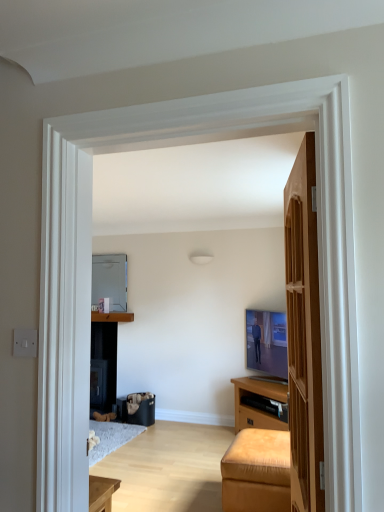
Question: Does leather ottoman at lower right have a greater width compared to wooden door at right?

Choices:
 (A) yes
 (B) no

Answer: (A)

Question: From the image's perspective, would you say leather ottoman at lower right is shown under wooden door at right?

Choices:
 (A) yes
 (B) no

Answer: (A)

Question: Considering the relative sizes of leather ottoman at lower right and wooden door at right in the image provided, is leather ottoman at lower right taller than wooden door at right?

Choices:
 (A) yes
 (B) no

Answer: (B)

Question: Is leather ottoman at lower right at the left side of wooden door at right?

Choices:
 (A) no
 (B) yes

Answer: (A)

Question: Is leather ottoman at lower right positioned beyond the bounds of wooden door at right?

Choices:
 (A) yes
 (B) no

Answer: (A)

Question: From a real-world perspective, is metallic refrigerator at center positioned above or below leather ottoman at lower right?

Choices:
 (A) above
 (B) below

Answer: (A)

Question: Is metallic refrigerator at center situated inside leather ottoman at lower right or outside?

Choices:
 (A) inside
 (B) outside

Answer: (B)

Question: Based on their positions, is metallic refrigerator at center located to the left or right of leather ottoman at lower right?

Choices:
 (A) left
 (B) right

Answer: (A)

Question: Considering the positions of point (92, 291) and point (244, 478), is point (92, 291) closer or farther from the camera than point (244, 478)?

Choices:
 (A) closer
 (B) farther

Answer: (B)

Question: Is matte brown cabinet at center wider or thinner than metallic refrigerator at center?

Choices:
 (A) thin
 (B) wide

Answer: (B)

Question: Based on their positions, is matte brown cabinet at center located to the left or right of metallic refrigerator at center?

Choices:
 (A) right
 (B) left

Answer: (A)

Question: Is matte brown cabinet at center bigger or smaller than metallic refrigerator at center?

Choices:
 (A) big
 (B) small

Answer: (B)

Question: Is point (129, 318) closer or farther from the camera than point (94, 270)?

Choices:
 (A) closer
 (B) farther

Answer: (A)

Question: Is leather ottoman at lower right inside or outside of wooden door at right?

Choices:
 (A) inside
 (B) outside

Answer: (B)

Question: Relative to wooden door at right, is leather ottoman at lower right in front or behind?

Choices:
 (A) front
 (B) behind

Answer: (B)